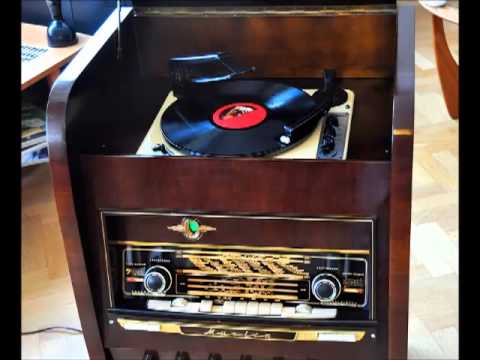
Where is `tables`? tables is located at coordinates (51, 54), (447, 12).